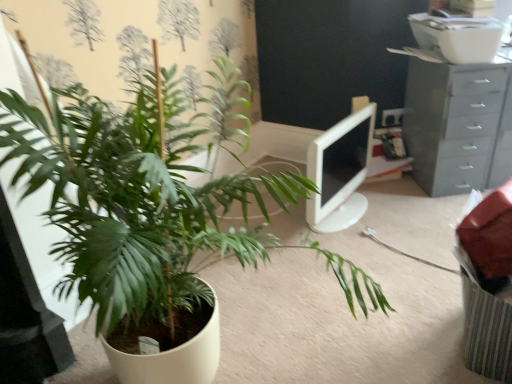
Question: Is gray plastic chest of drawers at upper right inside or outside of green matte plant at center-left?

Choices:
 (A) inside
 (B) outside

Answer: (B)

Question: In terms of width, does gray plastic chest of drawers at upper right look wider or thinner when compared to green matte plant at center-left?

Choices:
 (A) wide
 (B) thin

Answer: (B)

Question: Which of these objects is positioned farthest from the green matte plant at center-left?

Choices:
 (A) gray plastic chest of drawers at upper right
 (B) white glossy monitor at center

Answer: (A)

Question: Estimate the real-world distances between objects in this image. Which object is closer to the white glossy monitor at center?

Choices:
 (A) green matte plant at center-left
 (B) gray plastic chest of drawers at upper right

Answer: (B)